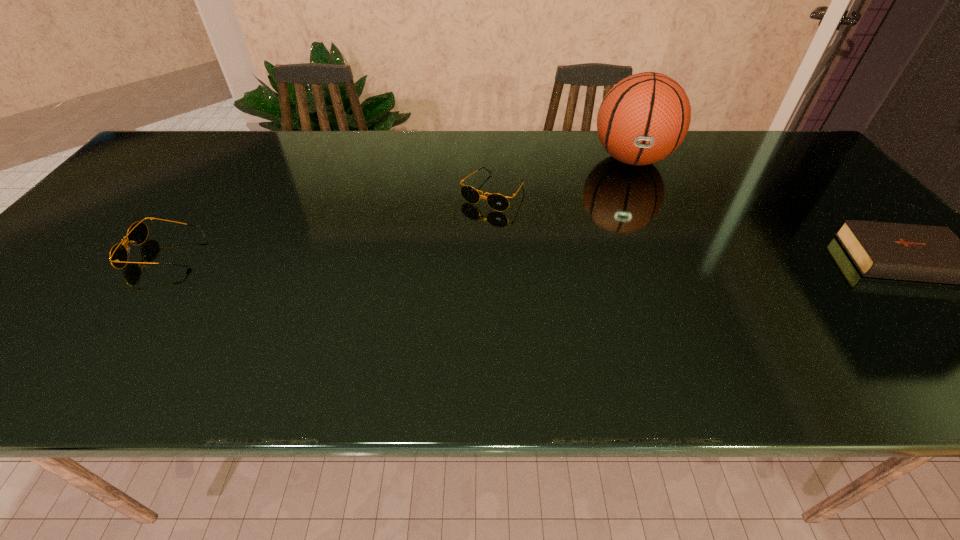
You are a GUI agent. You are given a task and a screenshot of the screen. Output one action in this format:
    pyautogui.click(x=<x>, y=<y>)
    Task: Click on the free space located on the side where the inflation valve is located
    
    Given the screenshot: What is the action you would take?
    pyautogui.click(x=637, y=278)

Image resolution: width=960 pixels, height=540 pixels. I want to click on vacant space located 0.250m on the side where the inflation valve is located, so [x=636, y=240].

What are the coordinates of `vacant space located on the lenses of the second object from left to right` in the screenshot? It's located at (438, 265).

At what (x,y) coordinates should I click in order to perform the action: click on vacant point located 0.330m on the lenses of the second object from left to right. Please return your answer as a coordinate pair (x, y). This screenshot has height=540, width=960. Looking at the image, I should click on (413, 298).

Where is `vacant space located 0.360m on the lenses of the second object from left to right`? This screenshot has height=540, width=960. vacant space located 0.360m on the lenses of the second object from left to right is located at coordinates (405, 308).

You are a GUI agent. You are given a task and a screenshot of the screen. Output one action in this format:
    pyautogui.click(x=<x>, y=<y>)
    Task: Click on the object located in the far edge section of the desktop
    
    Given the screenshot: What is the action you would take?
    pyautogui.click(x=644, y=118)

In the image, there is a desktop. Where is `free space at the far edge`? free space at the far edge is located at coordinates (256, 156).

Locate an element on the screen. The height and width of the screenshot is (540, 960). vacant region at the near edge is located at coordinates (426, 317).

The width and height of the screenshot is (960, 540). Find the location of `free space at the left edge of the desktop`. free space at the left edge of the desktop is located at coordinates (156, 205).

What are the coordinates of `vacant space at the right edge of the desktop` in the screenshot? It's located at (884, 278).